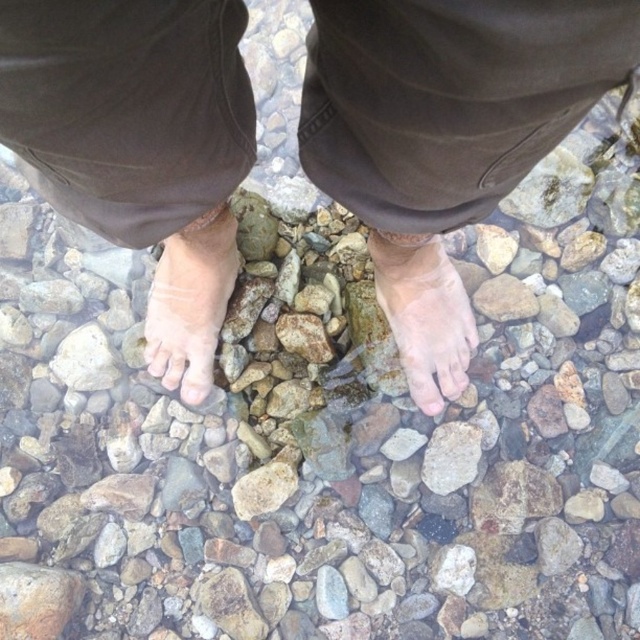
You are a photographer trying to capture the texture of the stones and the contrast between the feet and the skin. Since you want to focus on the feet, which object should you zoom in on more, the skinny bare feet at center or the pale skin at center?

The skinny bare feet at center is bigger than the pale skin at center, so you should zoom in on the skinny bare feet at center to focus on the larger object.

You are standing at the point marked by the coordinates point (445,136) in the image. What object is exactly at this location?

The skinny bare feet at center is exactly at point (445,136).